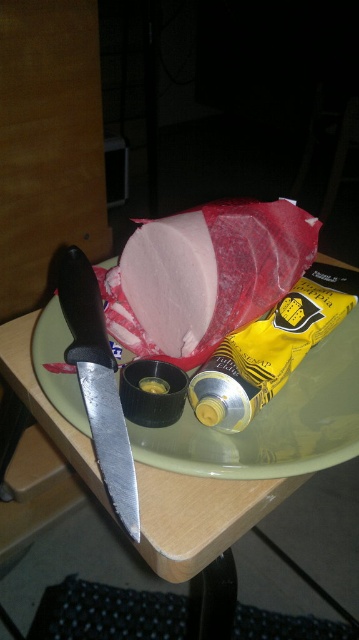
Question: Can you confirm if pink smooth ham at center is positioned above polished silver knife at left?

Choices:
 (A) no
 (B) yes

Answer: (B)

Question: Which is nearer to the green matte plate at center?

Choices:
 (A) polished silver knife at left
 (B) pink smooth ham at center

Answer: (A)

Question: Which point appears farthest from the camera in this image?

Choices:
 (A) (170, 225)
 (B) (95, 452)

Answer: (A)

Question: Which object appears closest to the camera in this image?

Choices:
 (A) green matte plate at center
 (B) polished silver knife at left

Answer: (B)

Question: Is pink smooth ham at center to the left of green matte plate at center from the viewer's perspective?

Choices:
 (A) no
 (B) yes

Answer: (B)

Question: In this image, where is pink smooth ham at center located relative to polished silver knife at left?

Choices:
 (A) left
 (B) right

Answer: (B)